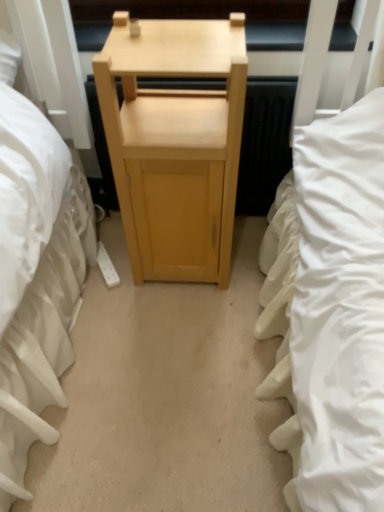
What is the approximate width of light wood nightstand at center?

The width of light wood nightstand at center is 12.79 inches.

The height and width of the screenshot is (512, 384). Find the location of `light wood nightstand at center`. light wood nightstand at center is located at coordinates (175, 144).

This screenshot has height=512, width=384. What do you see at coordinates (175, 144) in the screenshot?
I see `light wood nightstand at center` at bounding box center [175, 144].

Locate an element on the screen. light wood nightstand at center is located at coordinates (175, 144).